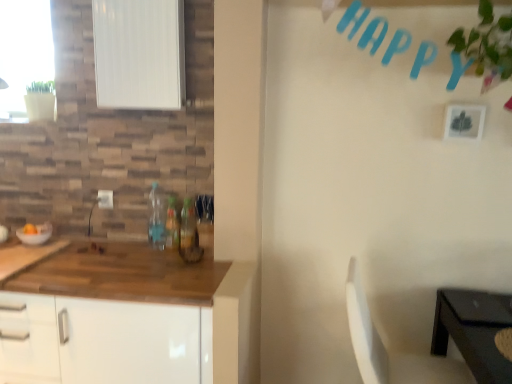
Question: Does white matte picture frame at upper right have a lesser width compared to translucent plastic bottle at center, the first bottle viewed from the left?

Choices:
 (A) yes
 (B) no

Answer: (A)

Question: Is white matte picture frame at upper right oriented towards translucent plastic bottle at center, which is the 3th bottle from right to left?

Choices:
 (A) no
 (B) yes

Answer: (A)

Question: From a real-world perspective, is white matte picture frame at upper right below translucent plastic bottle at center, which is the 3th bottle from right to left?

Choices:
 (A) yes
 (B) no

Answer: (B)

Question: From the image's perspective, is white matte picture frame at upper right below translucent plastic bottle at center, the first bottle viewed from the left?

Choices:
 (A) no
 (B) yes

Answer: (A)

Question: Is translucent plastic bottle at center, the first bottle viewed from the left, inside white matte picture frame at upper right?

Choices:
 (A) no
 (B) yes

Answer: (A)

Question: From the image's perspective, is white matte cabinet at lower left positioned above or below translucent plastic bottle at center, which is the second bottle in left-to-right order?

Choices:
 (A) above
 (B) below

Answer: (B)

Question: In terms of height, does white matte cabinet at lower left look taller or shorter compared to translucent plastic bottle at center, which is counted as the 2th bottle, starting from the right?

Choices:
 (A) short
 (B) tall

Answer: (B)

Question: From a real-world perspective, relative to translucent plastic bottle at center, which is counted as the 2th bottle, starting from the right, is white matte cabinet at lower left vertically above or below?

Choices:
 (A) below
 (B) above

Answer: (A)

Question: Is white matte cabinet at lower left inside the boundaries of translucent plastic bottle at center, which is the second bottle in left-to-right order, or outside?

Choices:
 (A) inside
 (B) outside

Answer: (B)

Question: From the image's perspective, relative to white matte window screen at upper left, is green leafy plant at upper right above or below?

Choices:
 (A) below
 (B) above

Answer: (A)

Question: Considering the positions of point (487, 54) and point (112, 1), is point (487, 54) closer or farther from the camera than point (112, 1)?

Choices:
 (A) closer
 (B) farther

Answer: (A)

Question: From a real-world perspective, relative to white matte window screen at upper left, is green leafy plant at upper right vertically above or below?

Choices:
 (A) above
 (B) below

Answer: (B)

Question: In the image, is green leafy plant at upper right on the left side or the right side of white matte window screen at upper left?

Choices:
 (A) left
 (B) right

Answer: (B)

Question: Is white plastic chair at lower right wider or thinner than white matte picture frame at upper right?

Choices:
 (A) thin
 (B) wide

Answer: (B)

Question: From their relative heights in the image, would you say white plastic chair at lower right is taller or shorter than white matte picture frame at upper right?

Choices:
 (A) short
 (B) tall

Answer: (B)